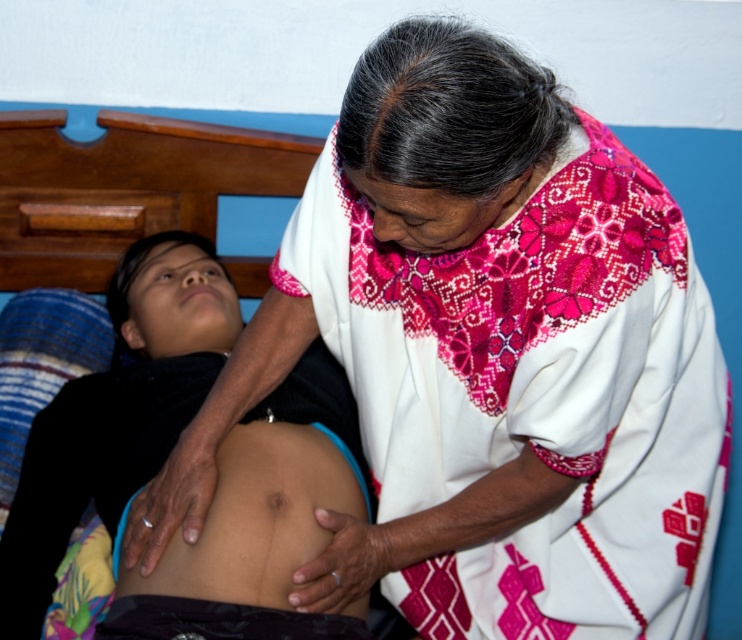
Question: Observing the image, what is the correct spatial positioning of skinny white skin at center in reference to smooth skin at center?

Choices:
 (A) below
 (B) above

Answer: (B)

Question: Which object appears closest to the camera in this image?

Choices:
 (A) skinny white skin at center
 (B) smooth skin at center

Answer: (A)

Question: Which object is closer to the camera taking this photo?

Choices:
 (A) skinny white skin at center
 (B) smooth skin at center

Answer: (A)

Question: In this image, where is skinny white skin at center located relative to smooth skin at center?

Choices:
 (A) right
 (B) left

Answer: (B)

Question: Can you confirm if skinny white skin at center is positioned to the right of smooth skin at center?

Choices:
 (A) yes
 (B) no

Answer: (B)